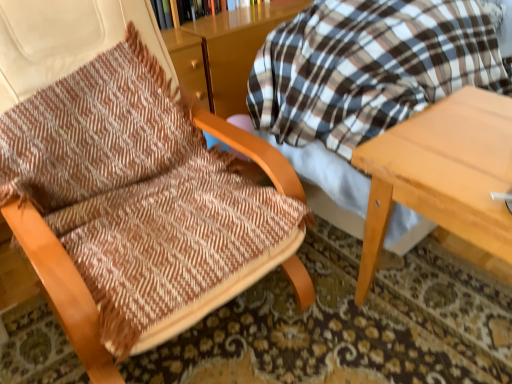
Where is `vacant point above light wood table at right (from a real-world perspective)`? The image size is (512, 384). vacant point above light wood table at right (from a real-world perspective) is located at coordinates (466, 138).